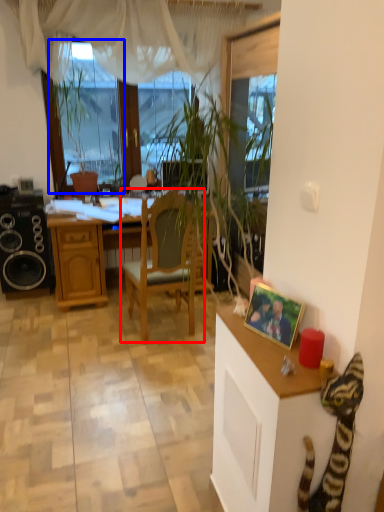
Question: Which point is closer to the camera, chair (highlighted by a red box) or window screen (highlighted by a blue box)?

Choices:
 (A) chair
 (B) window screen

Answer: (A)